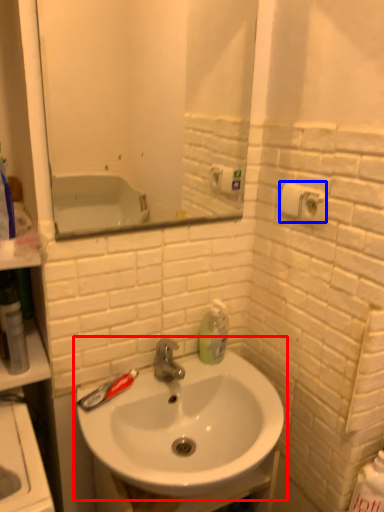
Question: Which object appears closest to the camera in this image, sink (highlighted by a red box) or toilet paper (highlighted by a blue box)?

Choices:
 (A) sink
 (B) toilet paper

Answer: (A)